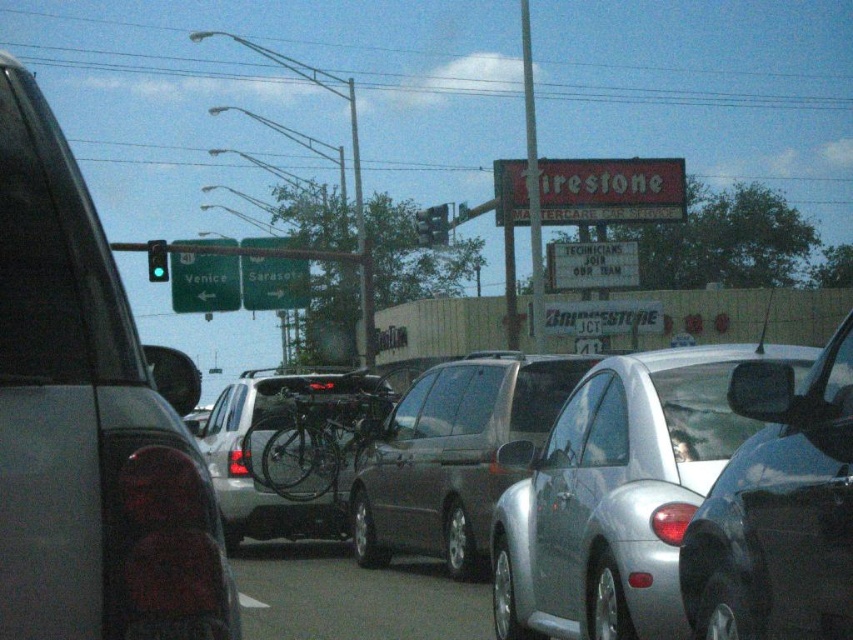
You are a driver approaching the intersection and want to know if there is a sedan at the center of the road. Based on the coordinates provided, can you confirm the presence of a sedan at point (453, 456)?

Yes, there is a satin silver sedan at center located at point (453, 456).

You are a driver trying to navigate through the intersection. You see two points marked on the road ahead. The first point is at coordinate point (444, 381), and the second is at coordinate point (196, 284). Which point is closer to your current position?

Point (444, 381) is closer to the viewer than point (196, 284).

What are the coordinates of the green matte street sign at upper center?

The green matte street sign at upper center is located at point (204,276).